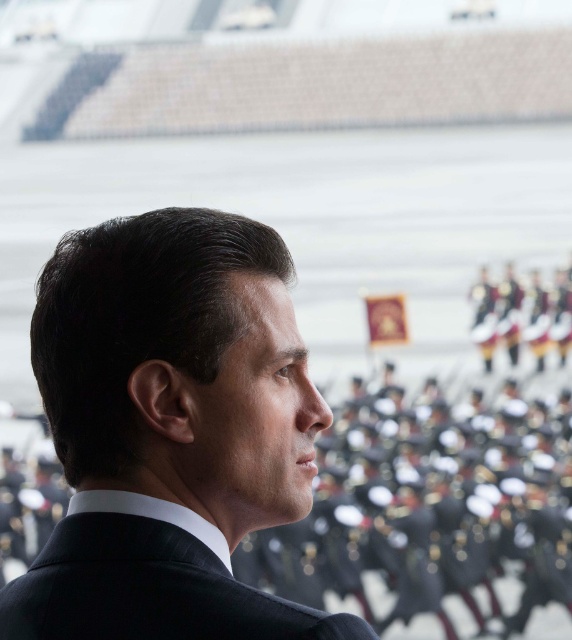
You are a fashion designer observing the image of a man in a suit. You need to determine which of the two suits, the black silk suit at center or the black pinstripe suit at center, would require more fabric to produce. Based on the visual information provided, which one would you choose?

The black silk suit at center has a larger size compared to the black pinstripe suit at center, so the black silk suit at center would require more fabric to produce.